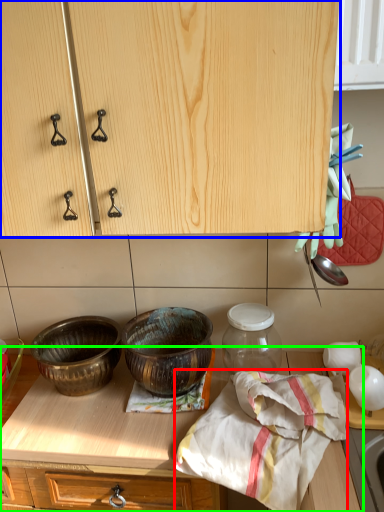
Question: Considering the real-world distances, which object is farthest from blanket (highlighted by a red box)? cabinetry (highlighted by a blue box) or countertop (highlighted by a green box)?

Choices:
 (A) cabinetry
 (B) countertop

Answer: (A)